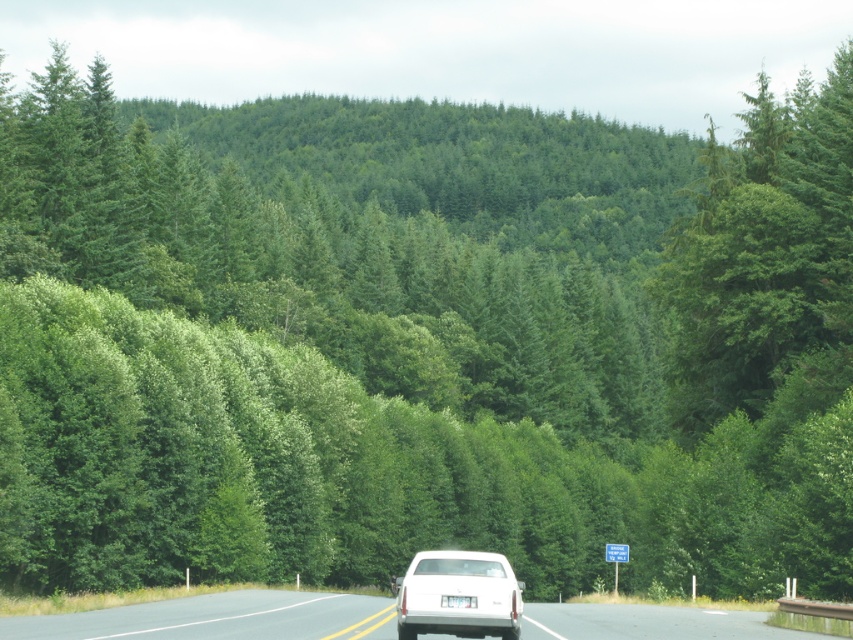
The image size is (853, 640). Find the location of `white glossy truck at center`. white glossy truck at center is located at coordinates (221, 618).

Image resolution: width=853 pixels, height=640 pixels. What do you see at coordinates (221, 618) in the screenshot?
I see `white glossy truck at center` at bounding box center [221, 618].

What do you see at coordinates (221, 618) in the screenshot? This screenshot has width=853, height=640. I see `white glossy truck at center` at bounding box center [221, 618].

This screenshot has width=853, height=640. Find the location of `white glossy truck at center`. white glossy truck at center is located at coordinates (221, 618).